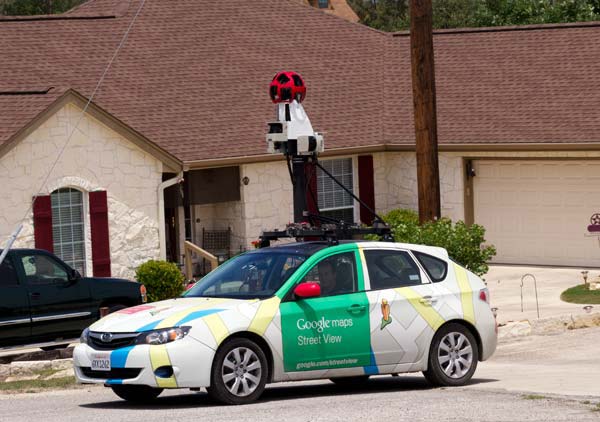
At what (x,y) coordinates should I click in order to perform the action: click on red shutters. Please return your answer as a coordinate pair (x, y). The image size is (600, 422). Looking at the image, I should click on (96, 240).